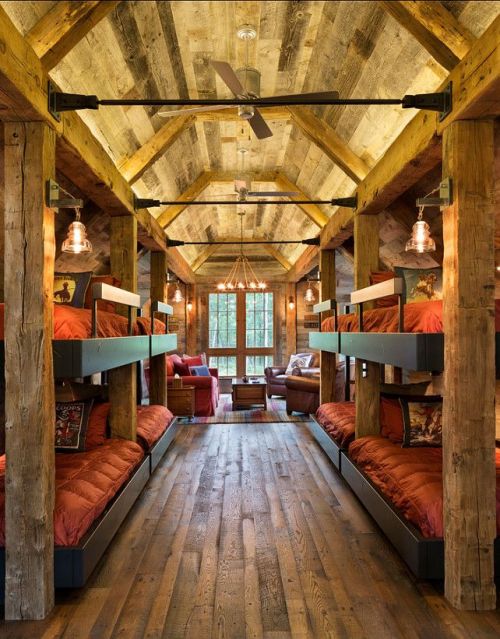
In order to click on floor in this screenshot , I will do `click(267, 618)`, `click(257, 498)`, `click(253, 443)`.